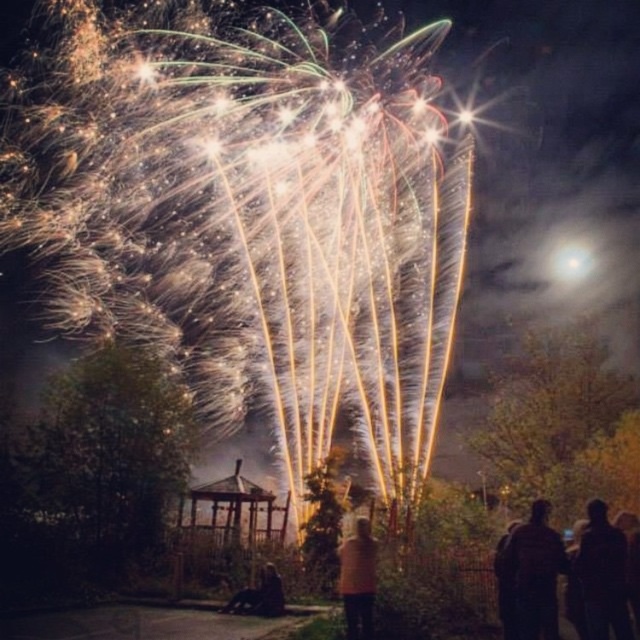
Is the position of wooden gazebo at center more distant than that of dark fabric coat at lower right?

Yes, wooden gazebo at center is behind dark fabric coat at lower right.

Who is shorter, wooden gazebo at center or dark fabric coat at lower right?

wooden gazebo at center is shorter.

You are a GUI agent. You are given a task and a screenshot of the screen. Output one action in this format:
    pyautogui.click(x=<x>, y=<y>)
    Task: Click on the wooden gazebo at center
    
    Given the screenshot: What is the action you would take?
    pyautogui.click(x=227, y=529)

Is dark fabric coat at lower right bigger than brown wool sweater at center?

No.

Is dark fabric coat at lower right positioned behind brown wool sweater at center?

No.

Which is in front, point (518, 573) or point (346, 548)?

Point (518, 573) is more forward.

The height and width of the screenshot is (640, 640). In order to click on dark fabric coat at lower right in this screenshot , I will do `click(532, 573)`.

Between dark fabric coat at lower right and dark hair at lower center, which one is positioned lower?

Positioned lower is dark hair at lower center.

From the picture: Between dark fabric coat at lower right and dark hair at lower center, which one has less height?

dark hair at lower center

Which is behind, point (560, 536) or point (273, 579)?

The point (273, 579) is more distant.

Where is `dark fabric coat at lower right`? dark fabric coat at lower right is located at coordinates (532, 573).